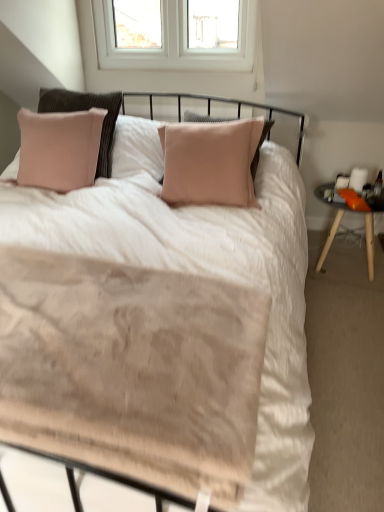
Question: Considering the positions of beige textured blanket at center and orange fabric nightstand at right in the image, is beige textured blanket at center bigger or smaller than orange fabric nightstand at right?

Choices:
 (A) small
 (B) big

Answer: (A)

Question: From a real-world perspective, is beige textured blanket at center physically located above or below orange fabric nightstand at right?

Choices:
 (A) below
 (B) above

Answer: (B)

Question: From the image's perspective, is beige textured blanket at center located above or below orange fabric nightstand at right?

Choices:
 (A) above
 (B) below

Answer: (B)

Question: From the image's perspective, relative to beige textured blanket at center, is orange fabric nightstand at right above or below?

Choices:
 (A) above
 (B) below

Answer: (A)

Question: In terms of height, does orange fabric nightstand at right look taller or shorter compared to beige textured blanket at center?

Choices:
 (A) tall
 (B) short

Answer: (A)

Question: Is orange fabric nightstand at right bigger or smaller than beige textured blanket at center?

Choices:
 (A) small
 (B) big

Answer: (B)

Question: Is orange fabric nightstand at right to the left or to the right of beige textured blanket at center in the image?

Choices:
 (A) left
 (B) right

Answer: (B)